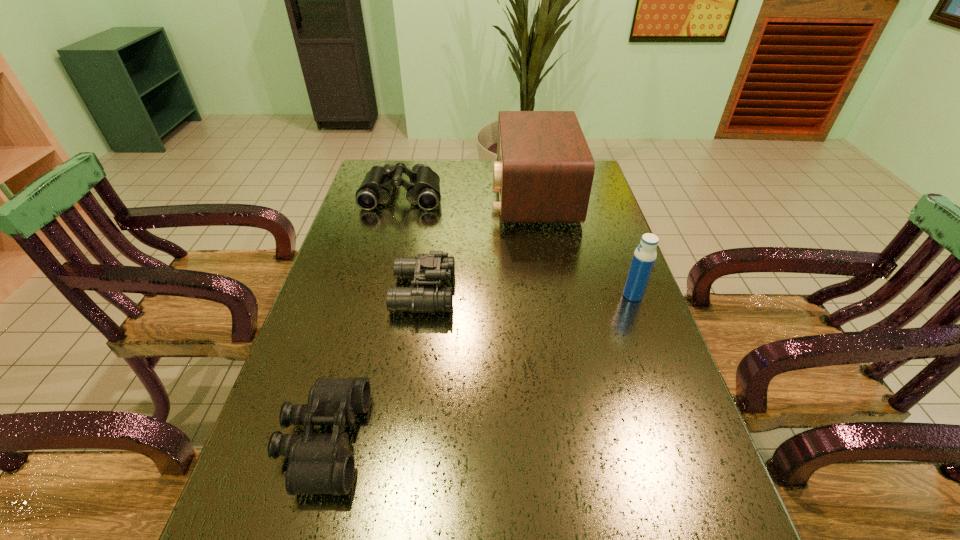
Locate an element on the screen. the second object from right to left is located at coordinates [x=544, y=169].

Identify the location of the tallest object. (544, 169).

Identify the location of water bottle. (645, 255).

The image size is (960, 540). Identify the location of the second tallest object. (645, 255).

Image resolution: width=960 pixels, height=540 pixels. I want to click on the second nearest binoculars, so click(424, 269).

Locate an element on the screen. the farthest binoculars is located at coordinates (423, 189).

Find the location of a particular element. Image resolution: width=960 pixels, height=540 pixels. the shortest binoculars is located at coordinates (318, 463).

Identify the location of the nearest binoculars. The image size is (960, 540). (318, 463).

Where is `vacant region located on the front panel of the tallest object`? vacant region located on the front panel of the tallest object is located at coordinates (401, 194).

Image resolution: width=960 pixels, height=540 pixels. I want to click on vacant space situated on the front panel of the tallest object, so click(409, 194).